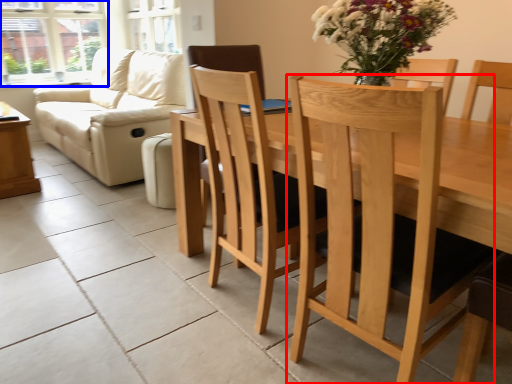
Question: Which point is closer to the camera, chair (highlighted by a red box) or window (highlighted by a blue box)?

Choices:
 (A) chair
 (B) window

Answer: (A)